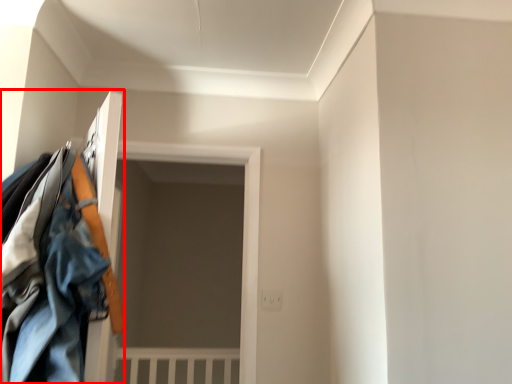
Question: From the image's perspective, where is closet (annotated by the red box) located in relation to door in the image?

Choices:
 (A) above
 (B) below

Answer: (A)